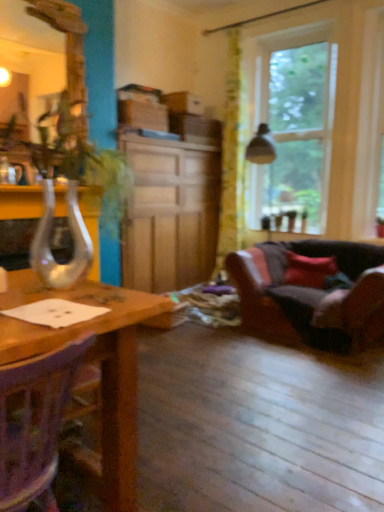
What do you see at coordinates (291, 120) in the screenshot? I see `clear glass window at upper right` at bounding box center [291, 120].

At what (x,y) coordinates should I click in order to perform the action: click on leather couch at lower right. Please return your answer as a coordinate pair (x, y). Looking at the image, I should click on (311, 292).

At what (x,y) coordinates should I click in order to perform the action: click on clear glass vase at left. Please return your answer as a coordinate pair (x, y). The width and height of the screenshot is (384, 512). Looking at the image, I should click on (72, 237).

The height and width of the screenshot is (512, 384). Describe the element at coordinates (231, 161) in the screenshot. I see `green floral fabric curtain at upper center` at that location.

Find the location of `red velvet cushion at right`. red velvet cushion at right is located at coordinates (308, 270).

What do you see at coordinates (308, 270) in the screenshot? I see `red velvet cushion at right` at bounding box center [308, 270].

Locate an element on the screen. This screenshot has width=384, height=512. clear glass window at upper right is located at coordinates (291, 120).

Considering the positions of objects wooden chair at lower left and clear glass vase at left in the image provided, who is more to the right, wooden chair at lower left or clear glass vase at left?

clear glass vase at left is more to the right.

Considering the positions of objects wooden chair at lower left and clear glass vase at left in the image provided, who is behind, wooden chair at lower left or clear glass vase at left?

wooden chair at lower left is further away from the camera.

Identify the location of chair that is below the clear glass vase at left (from the image's perspective). The width and height of the screenshot is (384, 512). (34, 423).

Is leather couch at lower right taller than green floral fabric curtain at upper center?

In fact, leather couch at lower right may be shorter than green floral fabric curtain at upper center.

Is point (315, 265) positioned after point (227, 127)?

No, (315, 265) is closer to viewer.

How different are the orientations of leather couch at lower right and green floral fabric curtain at upper center in degrees?

leather couch at lower right and green floral fabric curtain at upper center are facing 0.378 degrees away from each other.

Is clear glass vase at left looking in the opposite direction of red velvet cushion at right?

No, clear glass vase at left is not facing away from red velvet cushion at right.

Is clear glass vase at left situated inside red velvet cushion at right or outside?

clear glass vase at left is spatially situated outside red velvet cushion at right.

From a real-world perspective, who is located lower, clear glass vase at left or red velvet cushion at right?

red velvet cushion at right is physically lower.

Considering the relative positions of clear glass vase at left and red velvet cushion at right in the image provided, is clear glass vase at left behind red velvet cushion at right?

No.

From the image's perspective, is clear glass window at upper right located above clear glass vase at left?

Yes.

Which object is further away from the camera taking this photo, clear glass window at upper right or clear glass vase at left?

clear glass window at upper right is further away from the camera.

From a real-world perspective, does clear glass window at upper right stand above clear glass vase at left?

Yes.

Is clear glass window at upper right positioned with its back to clear glass vase at left?

clear glass window at upper right is not turned away from clear glass vase at left.

Does clear glass vase at left come behind clear glass vase at left?

No, clear glass vase at left is in front of clear glass vase at left.

Measure the distance between clear glass vase at left and clear glass vase at left.

They are 1.31 meters apart.

Is clear glass vase at left wider than clear glass vase at left?

Yes.

Is clear glass vase at left turned away from clear glass vase at left?

No, clear glass vase at left's orientation is not away from clear glass vase at left.

From the image's perspective, would you say green floral fabric curtain at upper center is shown under wooden cabinet at center?

Actually, green floral fabric curtain at upper center appears above wooden cabinet at center in the image.

Which is in front, green floral fabric curtain at upper center or wooden cabinet at center?

wooden cabinet at center is in front.

Can you confirm if green floral fabric curtain at upper center is positioned to the left of wooden cabinet at center?

No.

Where is `curtain located above the wooden cabinet at center (from a real-world perspective)`? curtain located above the wooden cabinet at center (from a real-world perspective) is located at coordinates (231, 161).

I want to click on chair that is on the right side of clear glass vase at left, so click(34, 423).

How many degrees apart are the facing directions of clear glass vase at left and wooden chair at lower left?

clear glass vase at left and wooden chair at lower left are facing 92 degrees away from each other.

Can you confirm if clear glass vase at left is bigger than wooden chair at lower left?

Correct, clear glass vase at left is larger in size than wooden chair at lower left.

Is clear glass vase at left not within wooden chair at lower left?

Yes.

You are a GUI agent. You are given a task and a screenshot of the screen. Output one action in this format:
    pyautogui.click(x=<x>, y=<y>)
    Task: Click on the chair behind the clear glass vase at left
    The height and width of the screenshot is (512, 384).
    Given the screenshot: What is the action you would take?
    pyautogui.click(x=34, y=423)

Where is `studio couch located underneath the green floral fabric curtain at upper center (from a real-world perspective)`? studio couch located underneath the green floral fabric curtain at upper center (from a real-world perspective) is located at coordinates (311, 292).

From the image, which object appears to be nearer to wooden chair at lower left, clear glass vase at left or red velvet cushion at right?

Among the two, clear glass vase at left is located nearer to wooden chair at lower left.

From the image, which object appears to be farther from red velvet cushion at right, green floral fabric curtain at upper center or wooden chair at lower left?

wooden chair at lower left.

Looking at the image, which one is located closer to wooden chair at lower left, green floral fabric curtain at upper center or wooden cabinet at center?

wooden cabinet at center is closer to wooden chair at lower left.

Estimate the real-world distances between objects in this image. Which object is further from green floral fabric curtain at upper center, clear glass window at upper right or leather couch at lower right?

The object further to green floral fabric curtain at upper center is leather couch at lower right.

From the image, which object appears to be nearer to clear glass vase at left, clear glass window at upper right or leather couch at lower right?

leather couch at lower right.

Estimate the real-world distances between objects in this image. Which object is further from wooden chair at lower left, wooden cabinet at center or clear glass window at upper right?

clear glass window at upper right is positioned further to the anchor wooden chair at lower left.

Estimate the real-world distances between objects in this image. Which object is closer to green floral fabric curtain at upper center, clear glass window at upper right or clear glass vase at left?

clear glass window at upper right is closer to green floral fabric curtain at upper center.

Based on their spatial positions, is red velvet cushion at right or clear glass vase at left further from green floral fabric curtain at upper center?

clear glass vase at left lies further to green floral fabric curtain at upper center than the other object.

Where is `pillow between clear glass vase at left and clear glass window at upper right from left to right`? The image size is (384, 512). pillow between clear glass vase at left and clear glass window at upper right from left to right is located at coordinates (308, 270).

Locate an element on the screen. Image resolution: width=384 pixels, height=512 pixels. glass vase positioned between clear glass vase at left and clear glass window at upper right from near to far is located at coordinates (72, 237).

Locate an element on the screen. cabinetry positioned between wooden chair at lower left and clear glass window at upper right from near to far is located at coordinates (169, 213).

Find the location of `cabinetry located between clear glass vase at left and red velvet cushion at right in the depth direction`. cabinetry located between clear glass vase at left and red velvet cushion at right in the depth direction is located at coordinates (169, 213).